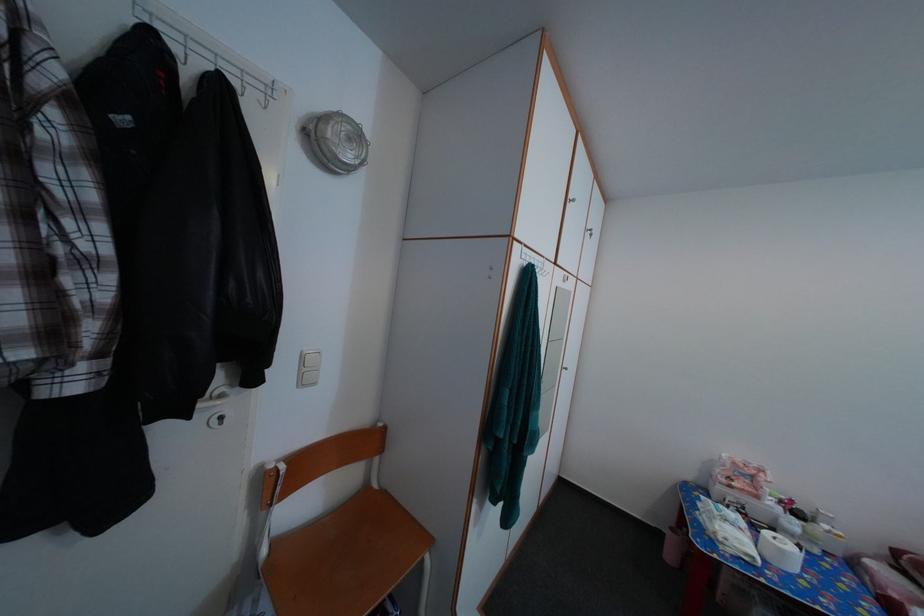
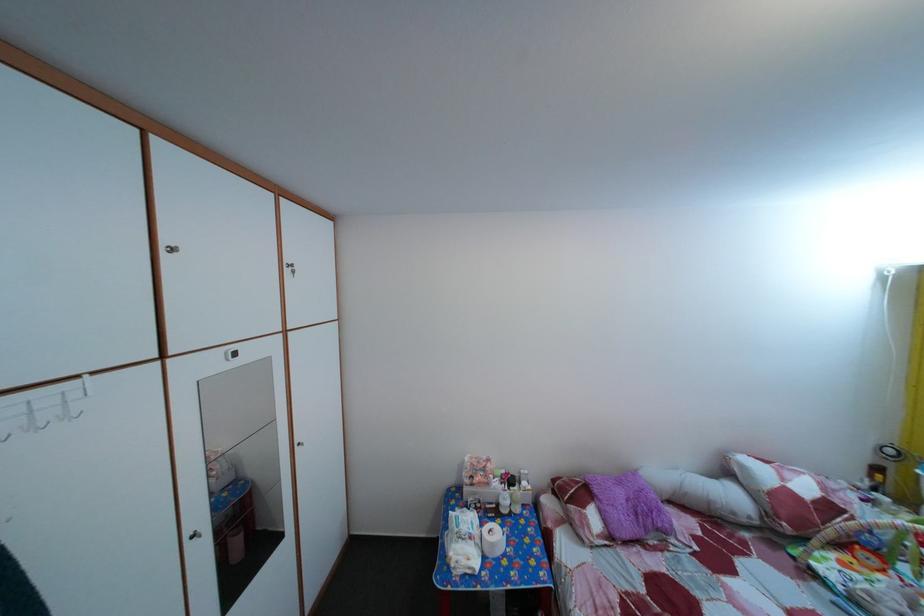
In the second image, find the point that corresponds to the point at 553,265 in the first image.

(86, 384)